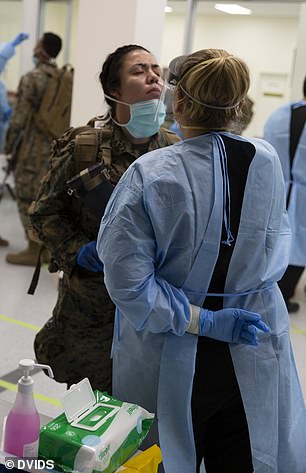
What are the coordinates of `wet wipes package` in the screenshot? It's located at (71, 437).